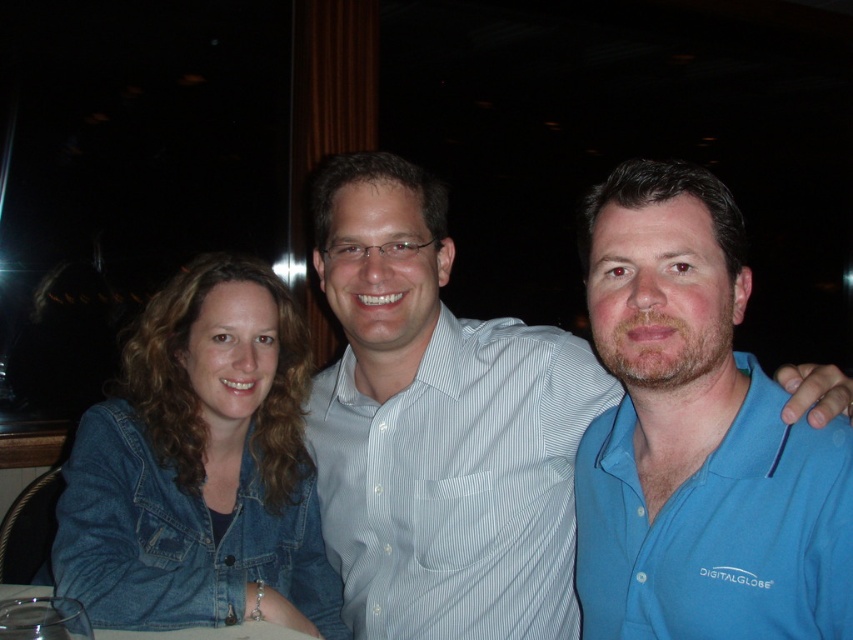
Question: Which point is farther to the camera?

Choices:
 (A) denim jacket at center
 (B) blue cotton polo at right
 (C) transparent glass at lower left

Answer: (A)

Question: Which object is closer to the camera taking this photo?

Choices:
 (A) light blue shirt at center
 (B) denim jacket at center
 (C) blue cotton polo at right
 (D) white striped shirt at center

Answer: (C)

Question: Is light blue shirt at center above white striped shirt at center?

Choices:
 (A) yes
 (B) no

Answer: (A)

Question: Considering the relative positions of blue cotton polo at right and transparent glass at lower left in the image provided, where is blue cotton polo at right located with respect to transparent glass at lower left?

Choices:
 (A) right
 (B) left

Answer: (A)

Question: Is light blue shirt at center positioned in front of transparent glass at lower left?

Choices:
 (A) yes
 (B) no

Answer: (B)

Question: Which point is closer to the camera taking this photo?

Choices:
 (A) (677, 548)
 (B) (447, 534)

Answer: (A)